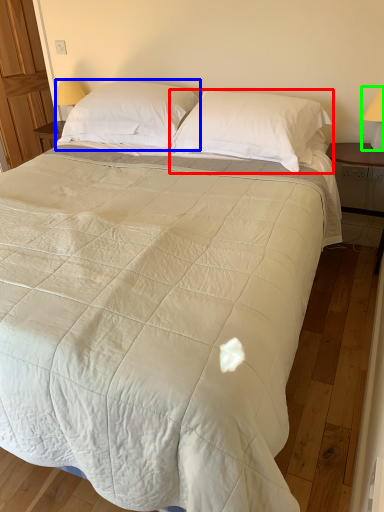
Question: Which object is positioned farthest from pillow (highlighted by a red box)? Select from pillow (highlighted by a blue box) and table lamp (highlighted by a green box).

Choices:
 (A) pillow
 (B) table lamp

Answer: (B)